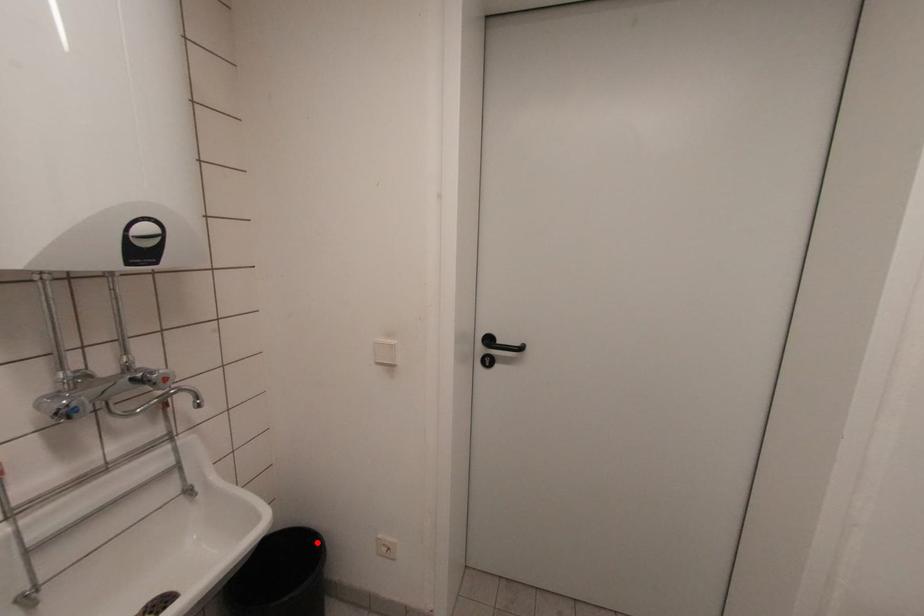
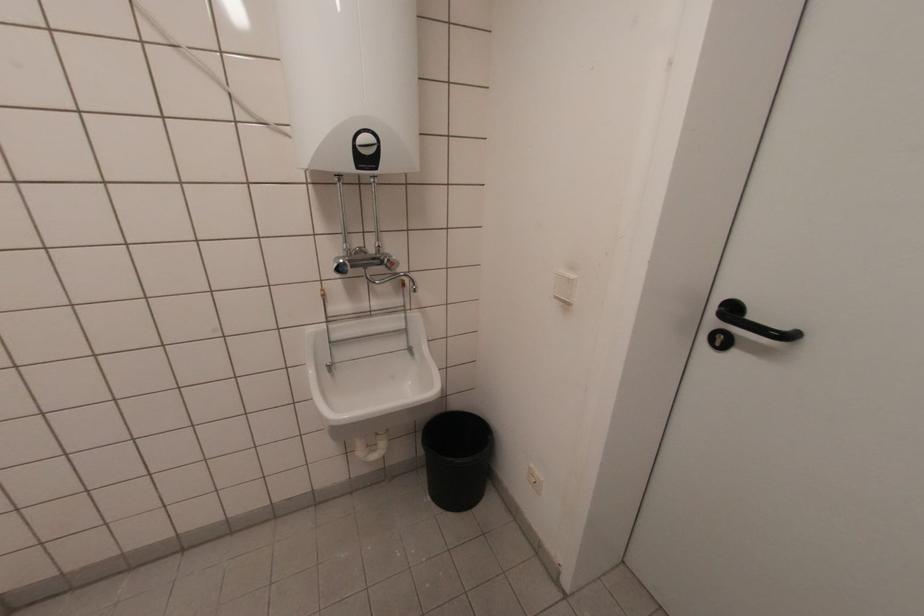
Locate, in the second image, the point that corresponds to the highlighted location in the first image.

(490, 438)